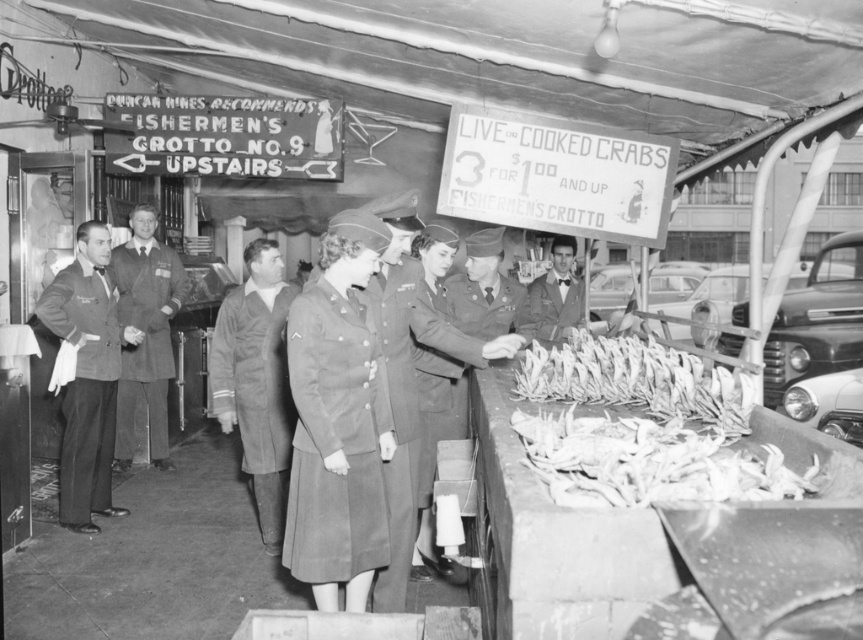
Question: Is gray wool uniform at center wider than matte gray uniform at center?

Choices:
 (A) yes
 (B) no

Answer: (B)

Question: Which point is farther to the camera?

Choices:
 (A) smooth gray suit at center
 (B) white crabs at center
 (C) gray wool uniform at center
 (D) matte gray uniform at center

Answer: (A)

Question: Does dark wool coat at center come behind uniform matte fabric at center?

Choices:
 (A) yes
 (B) no

Answer: (A)

Question: Can you confirm if white crabs at center is positioned below smooth gray suit at center?

Choices:
 (A) no
 (B) yes

Answer: (B)

Question: Among these points, which one is farthest from the camera?

Choices:
 (A) coord(275,410)
 (B) coord(465,372)

Answer: (A)

Question: Which point is farther from the camera taking this photo?

Choices:
 (A) (438, 332)
 (B) (142, 381)
 (C) (375, 580)
 (D) (564, 330)

Answer: (D)